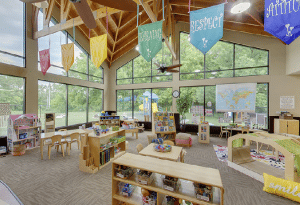
Locate an element on the screen. hanging flag is located at coordinates (43, 62), (68, 55), (95, 50), (148, 40), (213, 25), (290, 15).